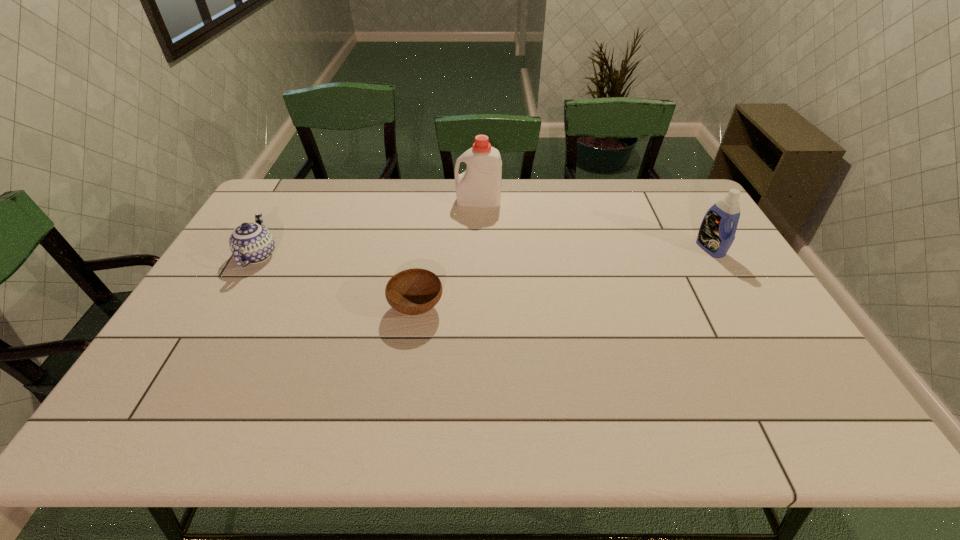
Find the location of a particular element. The height and width of the screenshot is (540, 960). free area in between the farther detergent and the rightmost object is located at coordinates (594, 225).

Find the location of a particular element. The height and width of the screenshot is (540, 960). vacant region between the right detergent and the left detergent is located at coordinates (594, 225).

Where is `blank region between the right detergent and the farthest object`? blank region between the right detergent and the farthest object is located at coordinates (594, 225).

I want to click on vacant space that's between the shortest object and the shorter detergent, so pos(564,278).

Locate an element on the screen. the second closest object to the left detergent is located at coordinates (252, 243).

This screenshot has width=960, height=540. Find the location of `object that can be found as the closest to the chinaware`. object that can be found as the closest to the chinaware is located at coordinates pyautogui.click(x=415, y=291).

What are the coordinates of `blank area in the image that satisfies the following two spatial constraints: 1. on the back side of the right detergent; 2. on the handle side of the third object from left to right` in the screenshot? It's located at (682, 201).

Where is `vacant position in the image that satisfies the following two spatial constraints: 1. on the handle side of the rightmost object; 2. on the left side of the farthest object`? The height and width of the screenshot is (540, 960). vacant position in the image that satisfies the following two spatial constraints: 1. on the handle side of the rightmost object; 2. on the left side of the farthest object is located at coordinates (478, 248).

The image size is (960, 540). In order to click on vacant space that satisfies the following two spatial constraints: 1. on the handle side of the nearer detergent; 2. on the right side of the third object from left to right in this screenshot , I will do click(478, 248).